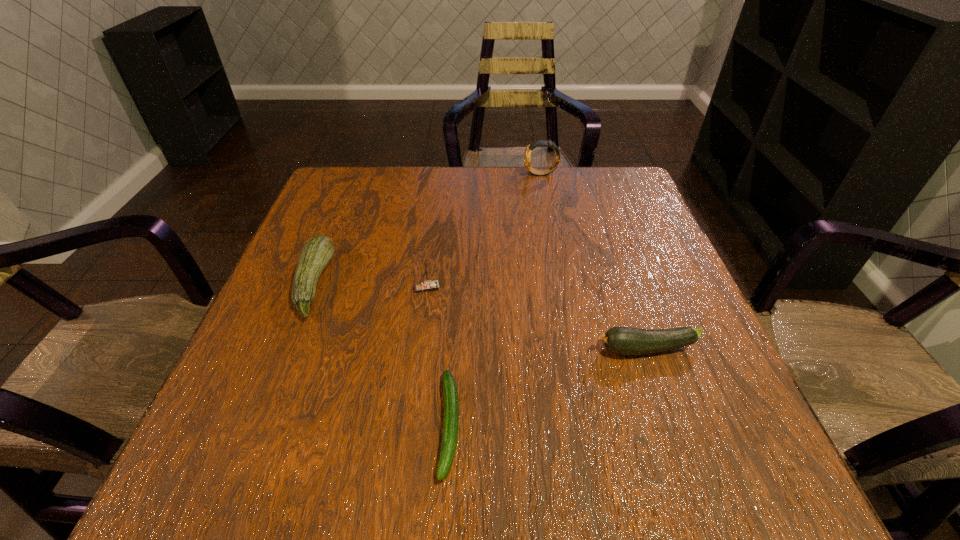
Identify the location of free space between the leftmost object and the watch. The width and height of the screenshot is (960, 540). (427, 229).

The image size is (960, 540). What are the coordinates of `vacant space in between the second object from left to right and the fourth tallest object` in the screenshot? It's located at (537, 318).

Where is `free point between the watch and the rightmost zucchini`? free point between the watch and the rightmost zucchini is located at coordinates coord(593,261).

Find the location of a particular element. Image resolution: width=960 pixels, height=540 pixels. free space between the second tallest zucchini and the leftmost object is located at coordinates (480, 316).

Where is `free spot between the farthest zucchini and the matchbox`? The width and height of the screenshot is (960, 540). free spot between the farthest zucchini and the matchbox is located at coordinates [x=371, y=285].

The image size is (960, 540). Find the location of `vacant space that is in between the tallest zucchini and the watch`. vacant space that is in between the tallest zucchini and the watch is located at coordinates (427, 229).

Where is `free spot between the tallest zucchini and the matchbox`? The height and width of the screenshot is (540, 960). free spot between the tallest zucchini and the matchbox is located at coordinates (371, 285).

This screenshot has height=540, width=960. I want to click on object that is the closest one to the watch, so click(x=425, y=286).

Identify which object is located as the fourth nearest to the farthest object. Please provide its 2D coordinates. Your answer should be formatted as a tuple, i.e. [(x, y)], where the tuple contains the x and y coordinates of a point satisfying the conditions above.

[(451, 401)]

Image resolution: width=960 pixels, height=540 pixels. Identify the location of the closest zucchini to the shortest zucchini. (619, 340).